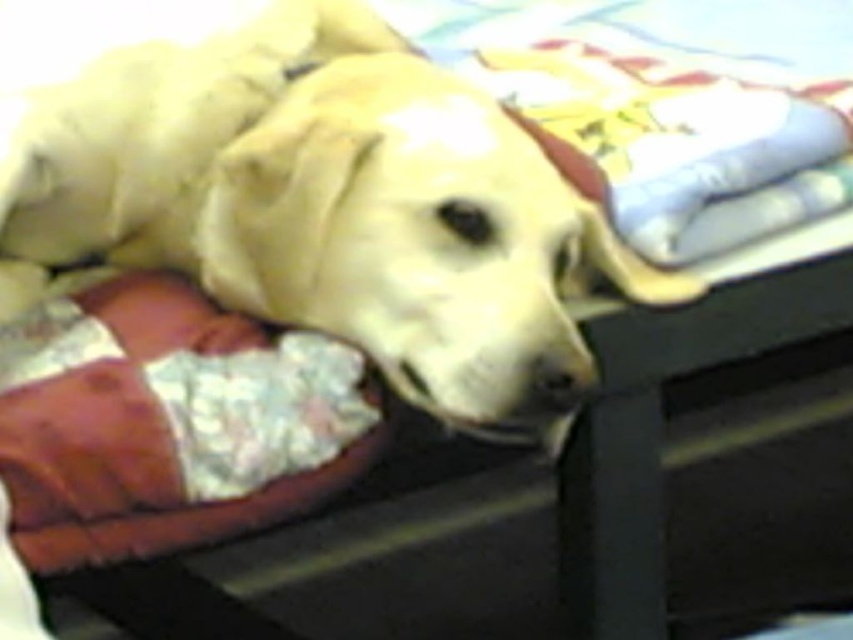
You are taking a photo of a dog lying on a bed. There are two points marked in the image at coordinates point (258,284) and point (285,451). Which point is closer to the camera?

Point (258,284) is closer to the camera than point (285,451).